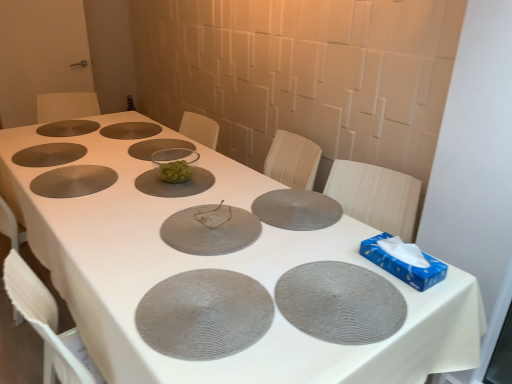
Where is `vacant area located to the right-hand side of clear glass bowl at center, acting as the 5th glass plate starting from the back`? vacant area located to the right-hand side of clear glass bowl at center, acting as the 5th glass plate starting from the back is located at coordinates (237, 180).